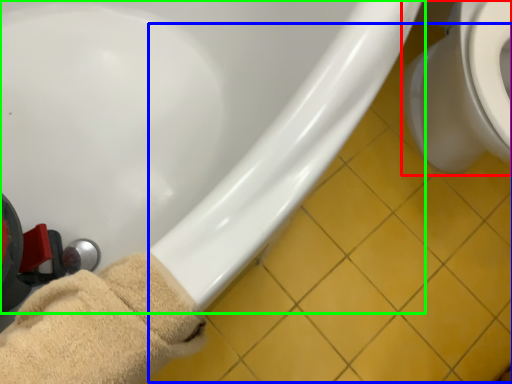
Question: Which object is the farthest from toilet (highlighted by a red box)? Choose among these: tile (highlighted by a blue box) or bathtub (highlighted by a green box).

Choices:
 (A) tile
 (B) bathtub

Answer: (B)